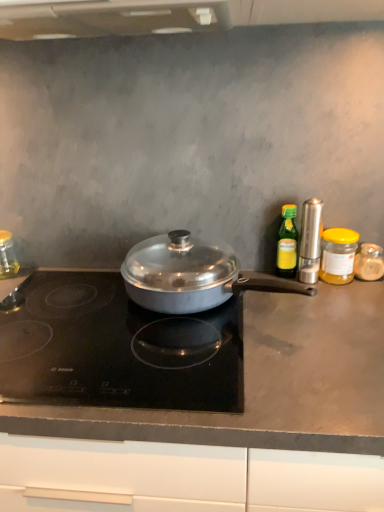
Locate an element on the screen. free area in between satin silver pan at center, the 2th kitchen appliance from the left, and translucent glass jar at right, which is counted as the 1th kitchen appliance, starting from the right is located at coordinates (339, 306).